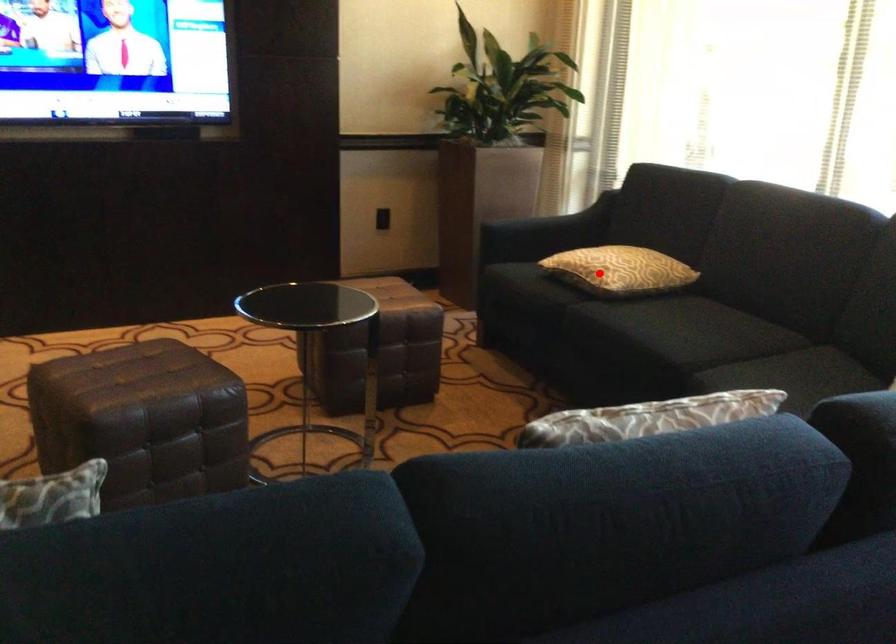
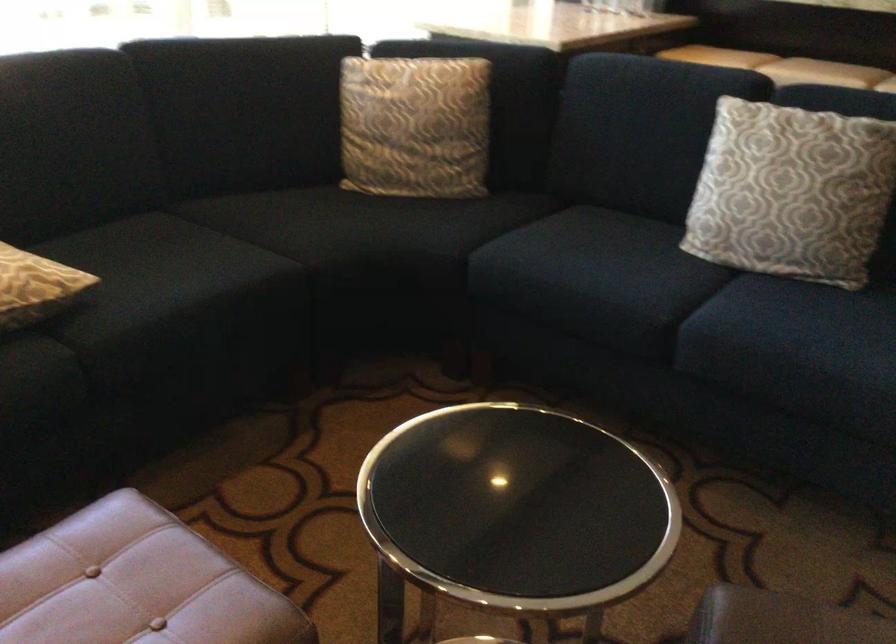
The point at the highlighted location is marked in the first image. Where is the corresponding point in the second image?

(35, 287)